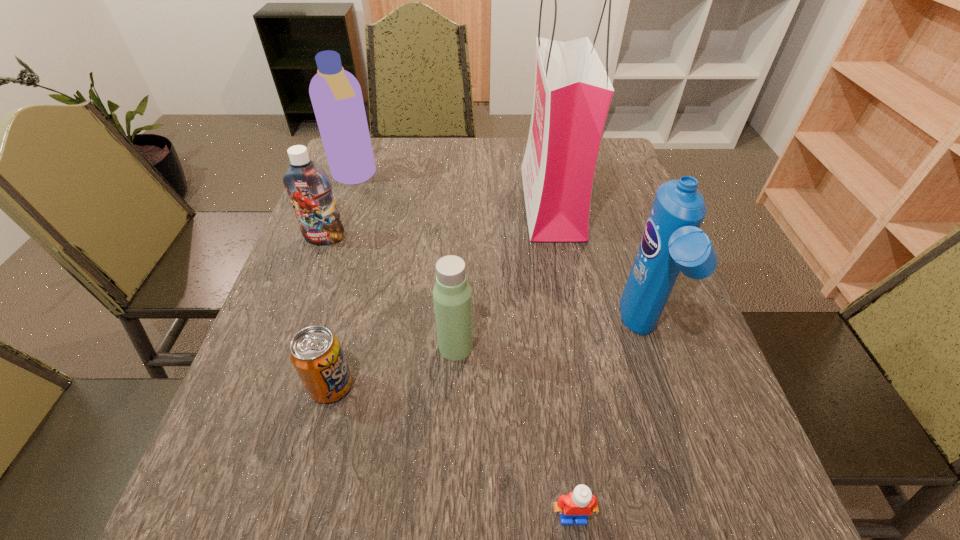
Find the location of a particular element. soda can that is at the left edge is located at coordinates (315, 352).

This screenshot has width=960, height=540. In order to click on object that is at the right edge in this screenshot , I will do `click(672, 241)`.

Locate an element on the screen. The height and width of the screenshot is (540, 960). object positioned at the far left corner is located at coordinates (336, 96).

Image resolution: width=960 pixels, height=540 pixels. I want to click on vacant point at the far edge, so click(504, 161).

At what (x,y) coordinates should I click in order to perform the action: click on vacant space at the near edge. Please return your answer as a coordinate pair (x, y). The width and height of the screenshot is (960, 540). Looking at the image, I should click on (449, 489).

Image resolution: width=960 pixels, height=540 pixels. Find the location of `vacant space at the left edge of the desktop`. vacant space at the left edge of the desktop is located at coordinates (356, 184).

Locate an element on the screen. This screenshot has height=540, width=960. free space at the right edge is located at coordinates (643, 383).

This screenshot has width=960, height=540. What are the coordinates of `free spot at the near left corner of the desktop` in the screenshot? It's located at (276, 530).

In the image, there is a desktop. At what (x,y) coordinates should I click in order to perform the action: click on vacant space at the far right corner. Please return your answer as a coordinate pair (x, y). Looking at the image, I should click on (619, 168).

Where is `vacant region between the farthest shampoo and the sixth tallest object`? vacant region between the farthest shampoo and the sixth tallest object is located at coordinates [x=343, y=281].